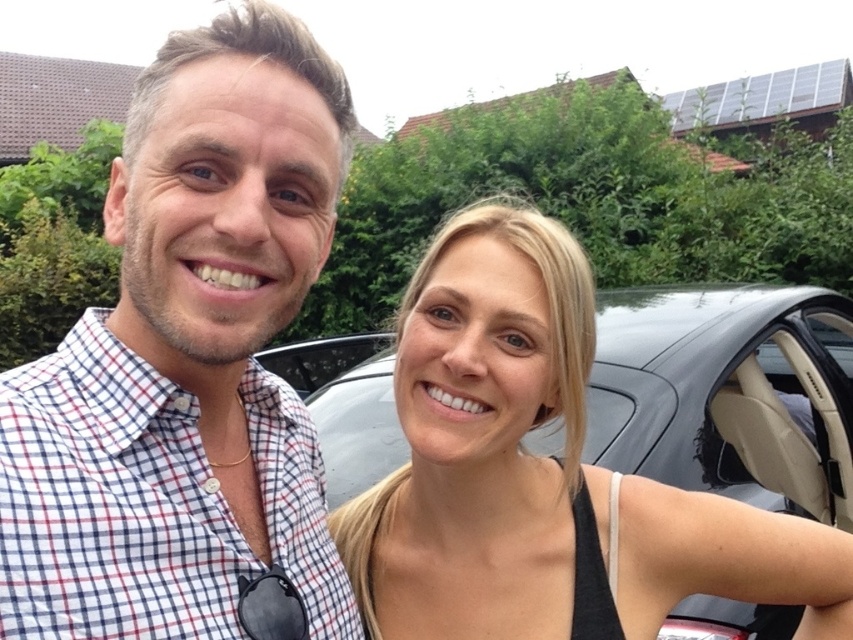
You are a photographer trying to capture a group photo of the checkered fabric shirt at center and the black matte tank top at right. Which clothing item should you adjust to ensure both are centered in the frame?

The checkered fabric shirt at center is positioned on the left side of the black matte tank top at right, so you should move the checkered fabric shirt at center to the right to align both items in the center of the frame.

You are taking a photo of two people standing in front of a parked car. You want to focus on the point closer to the camera. Which of the two points, point (x=115, y=243) or point (x=544, y=296), should you choose?

Point (x=115, y=243) is closer to the camera than point (x=544, y=296), so you should choose point (x=115, y=243) to focus on.